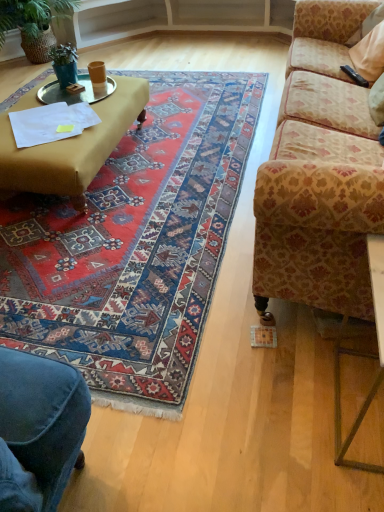
I want to click on metallic silver tray at upper left, so click(x=75, y=94).

Identify the location of metallic gold table at lower right. This screenshot has height=512, width=384. (361, 354).

Describe the element at coordinates (32, 15) in the screenshot. Image resolution: width=384 pixels, height=512 pixels. I see `green woven basket at upper left, acting as the 2th houseplant starting from the right` at that location.

What do you see at coordinates (64, 64) in the screenshot? I see `green matte plant at upper left, which ranks as the second houseplant in left-to-right order` at bounding box center [64, 64].

Locate an element on the screen. Image resolution: width=384 pixels, height=512 pixels. matte yellow ottoman at left is located at coordinates (71, 148).

You are a GUI agent. You are given a task and a screenshot of the screen. Output one action in this format:
    pyautogui.click(x=<x>, y=<y>)
    Task: Click on the patterned fabric couch at right
    The width and height of the screenshot is (384, 512).
    Given the screenshot: What is the action you would take?
    pyautogui.click(x=318, y=168)

The image size is (384, 512). Find the location of `metallic silver tray at upper left`. metallic silver tray at upper left is located at coordinates (75, 94).

From a real-world perspective, is metallic gold table at lower right above or below patterned fabric couch at right?

In terms of real-world spatial position, metallic gold table at lower right is below patterned fabric couch at right.

Considering the sizes of objects metallic gold table at lower right and patterned fabric couch at right in the image provided, who is smaller, metallic gold table at lower right or patterned fabric couch at right?

metallic gold table at lower right.

Considering the sizes of metallic gold table at lower right and patterned fabric couch at right in the image, is metallic gold table at lower right taller or shorter than patterned fabric couch at right?

In the image, metallic gold table at lower right appears to be shorter than patterned fabric couch at right.

Is point (377, 374) positioned behind point (286, 71)?

That is False.

From the picture: Can you confirm if metallic gold table at lower right is positioned to the right of matte yellow ottoman at left?

Yes.

What's the angular difference between metallic gold table at lower right and matte yellow ottoman at left's facing directions?

The angle between the facing direction of metallic gold table at lower right and the facing direction of matte yellow ottoman at left is 177 degrees.

Considering the sizes of metallic gold table at lower right and matte yellow ottoman at left in the image, is metallic gold table at lower right taller or shorter than matte yellow ottoman at left?

In the image, metallic gold table at lower right appears to be taller than matte yellow ottoman at left.

From a real-world perspective, is metallic gold table at lower right positioned above or below matte yellow ottoman at left?

From a real-world perspective, metallic gold table at lower right is physically above matte yellow ottoman at left.

Considering the positions of point (304, 237) and point (106, 330), is point (304, 237) closer or farther from the camera than point (106, 330)?

Point (304, 237) appears to be closer to the viewer than point (106, 330).

Is patterned fabric couch at right aimed at carpet with intricate patterns at center?

Yes, patterned fabric couch at right is oriented towards carpet with intricate patterns at center.

Who is more distant, patterned fabric couch at right or carpet with intricate patterns at center?

carpet with intricate patterns at center is behind.

Does patterned fabric couch at right have a smaller size compared to carpet with intricate patterns at center?

No.

Considering the relative sizes of green woven basket at upper left, which is the 2th houseplant from front to back, and metallic silver tray at upper left in the image provided, is green woven basket at upper left, which is the 2th houseplant from front to back, taller than metallic silver tray at upper left?

Yes, green woven basket at upper left, which is the 2th houseplant from front to back, is taller than metallic silver tray at upper left.

Is green woven basket at upper left, acting as the 2th houseplant starting from the right, oriented towards metallic silver tray at upper left?

Yes, green woven basket at upper left, acting as the 2th houseplant starting from the right, is turned towards metallic silver tray at upper left.

From the image's perspective, is green woven basket at upper left, placed as the 1th houseplant when sorted from top to bottom, located beneath metallic silver tray at upper left?

Actually, green woven basket at upper left, placed as the 1th houseplant when sorted from top to bottom, appears above metallic silver tray at upper left in the image.

Considering the relative positions of green woven basket at upper left, which is the 2th houseplant from front to back, and metallic silver tray at upper left in the image provided, is green woven basket at upper left, which is the 2th houseplant from front to back, to the left or to the right of metallic silver tray at upper left?

Clearly, green woven basket at upper left, which is the 2th houseplant from front to back, is on the left of metallic silver tray at upper left in the image.

What are the coordinates of `glass table lying above the black plastic remote control at upper right (from the image's perspective)` in the screenshot? It's located at (75, 94).

Between black plastic remote control at upper right and metallic silver tray at upper left, which one has larger size?

metallic silver tray at upper left.

Does point (362, 86) appear closer or farther from the camera than point (85, 92)?

Point (362, 86) is positioned closer to the camera compared to point (85, 92).

Is the depth of black plastic remote control at upper right less than that of metallic silver tray at upper left?

Yes, it is in front of metallic silver tray at upper left.

Looking at this image, visually, is metallic silver tray at upper left positioned to the left or to the right of black plastic remote control at upper right?

metallic silver tray at upper left is positioned on black plastic remote control at upper right's left side.

Locate an element on the screen. The height and width of the screenshot is (512, 384). glass table below the black plastic remote control at upper right (from a real-world perspective) is located at coordinates (75, 94).

From the image's perspective, is metallic silver tray at upper left located above black plastic remote control at upper right?

Yes, from the image's perspective, metallic silver tray at upper left is above black plastic remote control at upper right.

Does point (292, 55) lie in front of point (375, 282)?

That is False.

From the image's perspective, is patterned fabric couch at right above or below metallic gold table at lower right?

patterned fabric couch at right is above metallic gold table at lower right.

From the picture: Could you tell me if patterned fabric couch at right is turned towards metallic gold table at lower right?

No, patterned fabric couch at right does not turn towards metallic gold table at lower right.

Measure the distance between patterned fabric couch at right and metallic gold table at lower right.

patterned fabric couch at right and metallic gold table at lower right are 30.29 inches apart from each other.

The height and width of the screenshot is (512, 384). In order to click on studio couch that is on the right side of metallic gold table at lower right in this screenshot , I will do `click(318, 168)`.

Locate an element on the screen. The height and width of the screenshot is (512, 384). coffee table above the metallic gold table at lower right (from the image's perspective) is located at coordinates (71, 148).

When comparing their distances from black plastic remote control at upper right, does metallic silver tray at upper left or patterned fabric couch at right seem closer?

patterned fabric couch at right.

Estimate the real-world distances between objects in this image. Which object is further from metallic silver tray at upper left, carpet with intricate patterns at center or matte yellow ottoman at left?

Based on the image, carpet with intricate patterns at center appears to be further to metallic silver tray at upper left.

Considering their positions, is carpet with intricate patterns at center positioned closer to matte yellow ottoman at left than metallic silver tray at upper left?

metallic silver tray at upper left is closer to matte yellow ottoman at left.

From the image, which object appears to be farther from green matte plant at upper left, which ranks as the second houseplant in left-to-right order, metallic silver tray at upper left or carpet with intricate patterns at center?

The object further to green matte plant at upper left, which ranks as the second houseplant in left-to-right order, is carpet with intricate patterns at center.

Considering their positions, is black plastic remote control at upper right positioned further to carpet with intricate patterns at center than green matte plant at upper left, positioned as the 1th houseplant in front-to-back order?

black plastic remote control at upper right is further to carpet with intricate patterns at center.

Based on their spatial positions, is metallic silver tray at upper left or patterned fabric couch at right closer to green woven basket at upper left, which is the 2th houseplant from front to back?

Among the two, metallic silver tray at upper left is located nearer to green woven basket at upper left, which is the 2th houseplant from front to back.

Looking at the image, which one is located further to metallic silver tray at upper left, patterned fabric couch at right or matte yellow ottoman at left?

patterned fabric couch at right lies further to metallic silver tray at upper left than the other object.

From the image, which object appears to be nearer to carpet with intricate patterns at center, patterned fabric couch at right or green matte plant at upper left, acting as the second houseplant starting from the back?

The object closer to carpet with intricate patterns at center is patterned fabric couch at right.

Where is `mat between patterned fabric couch at right and green woven basket at upper left, the second houseplant ordered from the bottom, from front to back`? The height and width of the screenshot is (512, 384). mat between patterned fabric couch at right and green woven basket at upper left, the second houseplant ordered from the bottom, from front to back is located at coordinates (135, 245).

The width and height of the screenshot is (384, 512). In order to click on mat between metallic gold table at lower right and green matte plant at upper left, which is the 1th houseplant from right to left, from front to back in this screenshot , I will do `click(135, 245)`.

The height and width of the screenshot is (512, 384). Identify the location of studio couch situated between green woven basket at upper left, which is the 2th houseplant from front to back, and black plastic remote control at upper right from left to right. (318, 168).

Locate an element on the screen. This screenshot has width=384, height=512. glass table between carpet with intricate patterns at center and green woven basket at upper left, acting as the 2th houseplant starting from the right, in the front-back direction is located at coordinates (75, 94).